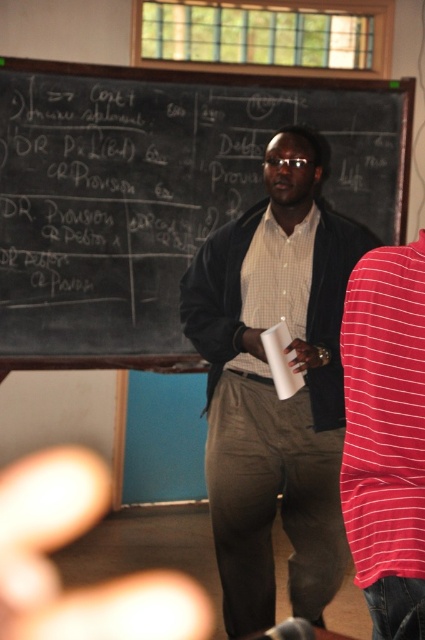
You are a student in this classroom and need to hand a note to the lecturer. The note is exactly 12 inches long. If you place it horizontally between the matte black jacket at center and the white matte paper cup at center, will the note fit without bending?

The distance between the matte black jacket at center and the white matte paper cup at center is 11.59 inches. Since the note is 12 inches long, it is slightly longer than the space available. Therefore, the note will not fit without bending.

You are a student sitting in the classroom and want to determine which of the two points, point (325, 289) or point (295, 259), is closer to the blackboard. Based on their positions, which point is nearer to the blackboard?

Point (325, 289) is in front of point (295, 259), so it is closer to the blackboard.